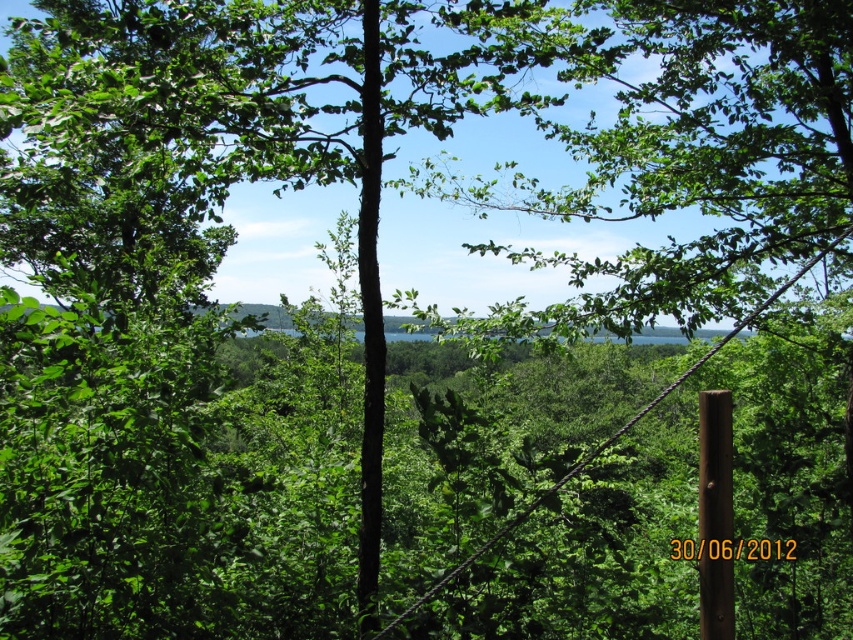
Question: Is black wood pole at center to the right of brown wooden pole at right from the viewer's perspective?

Choices:
 (A) no
 (B) yes

Answer: (A)

Question: Which of the following is the closest to the observer?

Choices:
 (A) (705, 397)
 (B) (370, 392)

Answer: (A)

Question: Does black wood pole at center appear on the left side of brown wooden pole at right?

Choices:
 (A) yes
 (B) no

Answer: (A)

Question: Observing the image, what is the correct spatial positioning of black wood pole at center in reference to brown wooden pole at right?

Choices:
 (A) below
 (B) above

Answer: (B)

Question: Which point appears closest to the camera in this image?

Choices:
 (A) (732, 598)
 (B) (376, 515)

Answer: (A)

Question: Which point is closer to the camera?

Choices:
 (A) click(x=709, y=477)
 (B) click(x=363, y=97)

Answer: (A)